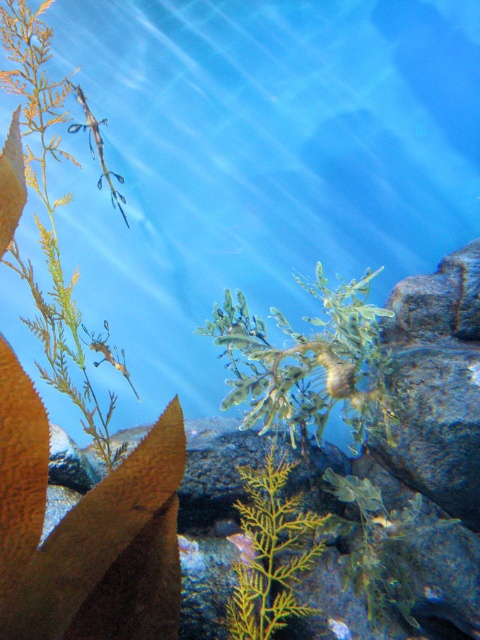
You are an underwater explorer in the aquarium. You see the green leafy plant at center and the translucent glass seahorse at upper left. Which object is larger in size?

The green leafy plant at center is bigger than the translucent glass seahorse at upper left according to the description.

You are an underwater explorer who wants to reach the translucent glass seahorse at upper left. There is a green leafy plant at center blocking your path. Can you move around it to get to the seahorse?

The green leafy plant at center is in front of the translucent glass seahorse at upper left, so you can move around it to reach the seahorse by going either to the left or right side of the plant.